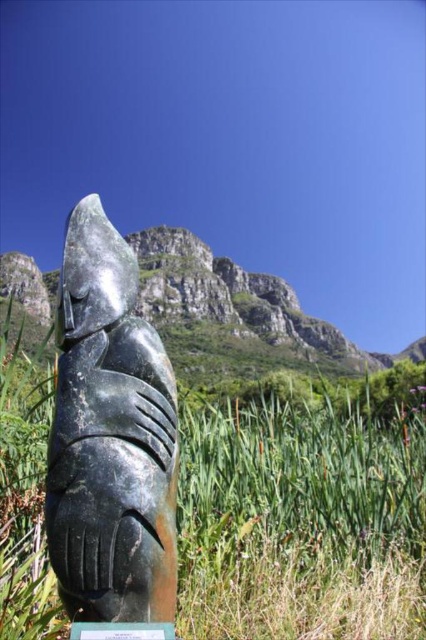
Consider the image. Can you confirm if black polished stone totem at center is taller than green stone plaque at center?

Yes, black polished stone totem at center is taller than green stone plaque at center.

Image resolution: width=426 pixels, height=640 pixels. Describe the element at coordinates (109, 436) in the screenshot. I see `black polished stone totem at center` at that location.

Identify the location of black polished stone totem at center. (109, 436).

Between green grass at center and green stone plaque at center, which one appears on the right side from the viewer's perspective?

green stone plaque at center is more to the right.

Is point (195, 481) farther from camera compared to point (97, 637)?

Yes, it is.

Image resolution: width=426 pixels, height=640 pixels. I want to click on green grass at center, so click(301, 520).

Does green grass at center have a smaller size compared to black polished stone totem at center?

Incorrect, green grass at center is not smaller in size than black polished stone totem at center.

Is point (388, 625) farther from camera compared to point (172, 451)?

That is True.

You are a GUI agent. You are given a task and a screenshot of the screen. Output one action in this format:
    pyautogui.click(x=<x>, y=<y>)
    Task: Click on the green grass at center
    This screenshot has height=640, width=426.
    Given the screenshot: What is the action you would take?
    pyautogui.click(x=301, y=520)